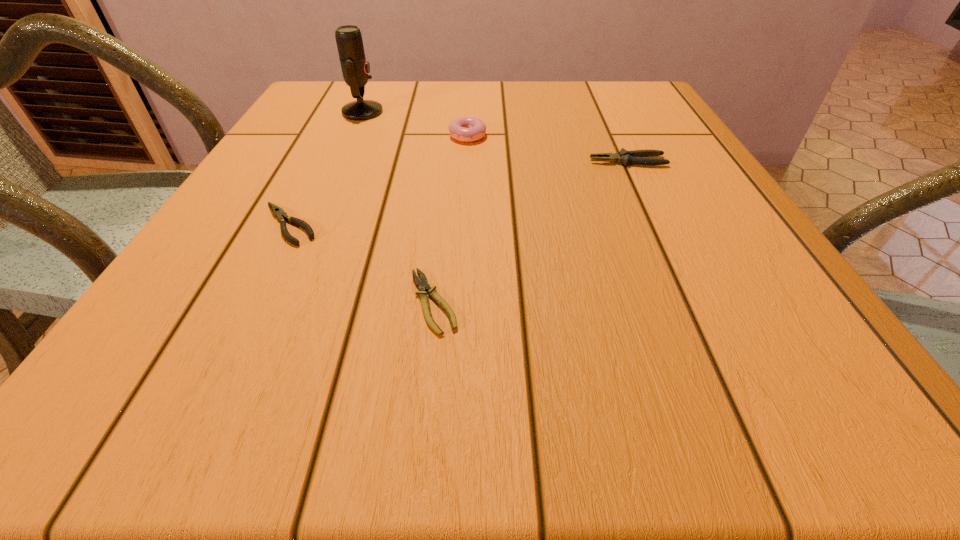
Locate an element on the screen. microphone is located at coordinates (355, 68).

Where is `the farthest object`? This screenshot has width=960, height=540. the farthest object is located at coordinates (355, 68).

Locate an element on the screen. This screenshot has width=960, height=540. doughnut is located at coordinates (466, 129).

Locate an element on the screen. the second tallest object is located at coordinates (466, 129).

Locate an element on the screen. the rightmost object is located at coordinates (625, 157).

The image size is (960, 540). I want to click on the tallest pliers, so click(625, 157).

I want to click on the second shortest pliers, so click(278, 212).

The width and height of the screenshot is (960, 540). I want to click on the fourth tallest object, so click(x=278, y=212).

Locate an element on the screen. the nearest object is located at coordinates (422, 284).

This screenshot has height=540, width=960. What are the coordinates of `the shortest object` in the screenshot? It's located at (422, 284).